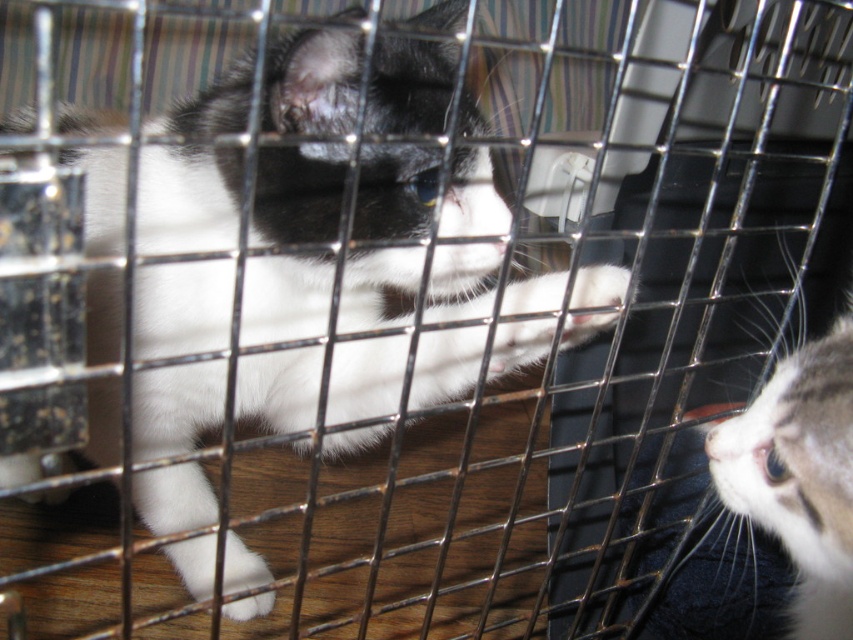
Is soft fur cat at center wider than white fur cat at right?

Yes.

Where is `soft fur cat at center`? The image size is (853, 640). soft fur cat at center is located at coordinates (300, 268).

Locate an element on the screen. The width and height of the screenshot is (853, 640). soft fur cat at center is located at coordinates (x=300, y=268).